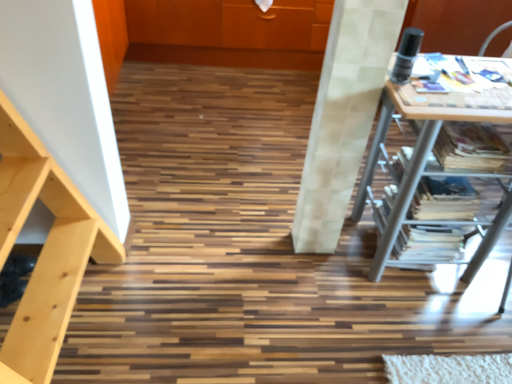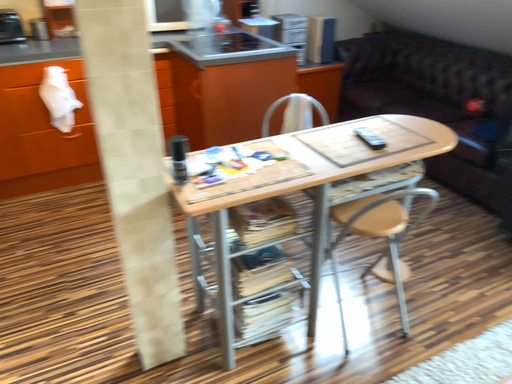
Question: How did the camera likely rotate when shooting the video?

Choices:
 (A) rotated left
 (B) rotated right

Answer: (B)